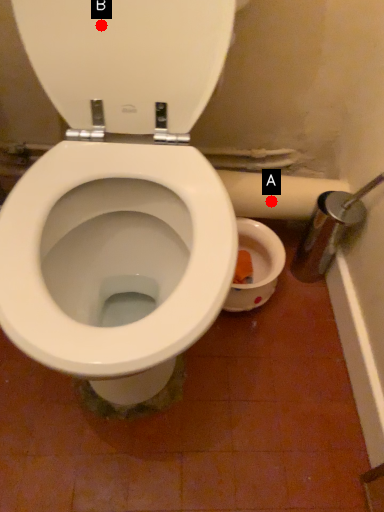
Question: Two points are circled on the image, labeled by A and B beside each circle. Which of the following is the farthest from the observer?

Choices:
 (A) A is further
 (B) B is further

Answer: (A)